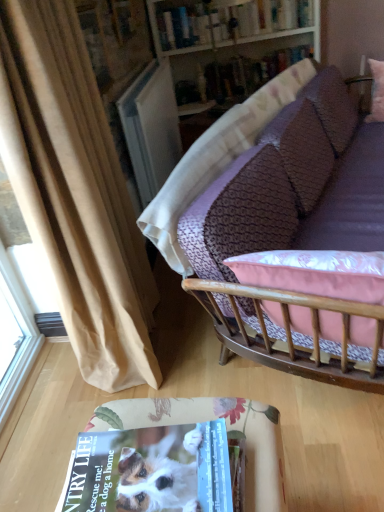
Locate an element on the screen. empty space that is ontop of floral fabric table at lower center (from a real-world perspective) is located at coordinates (153, 466).